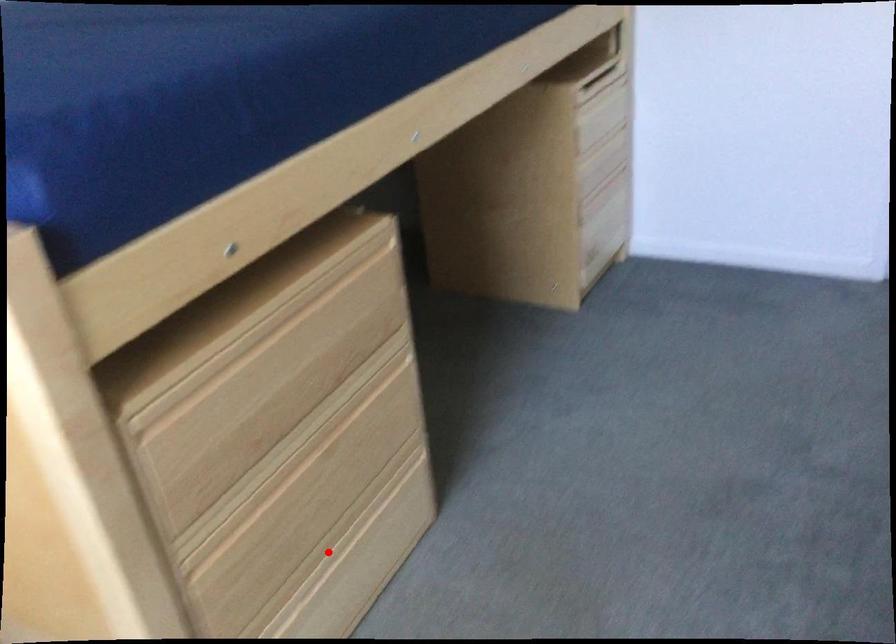
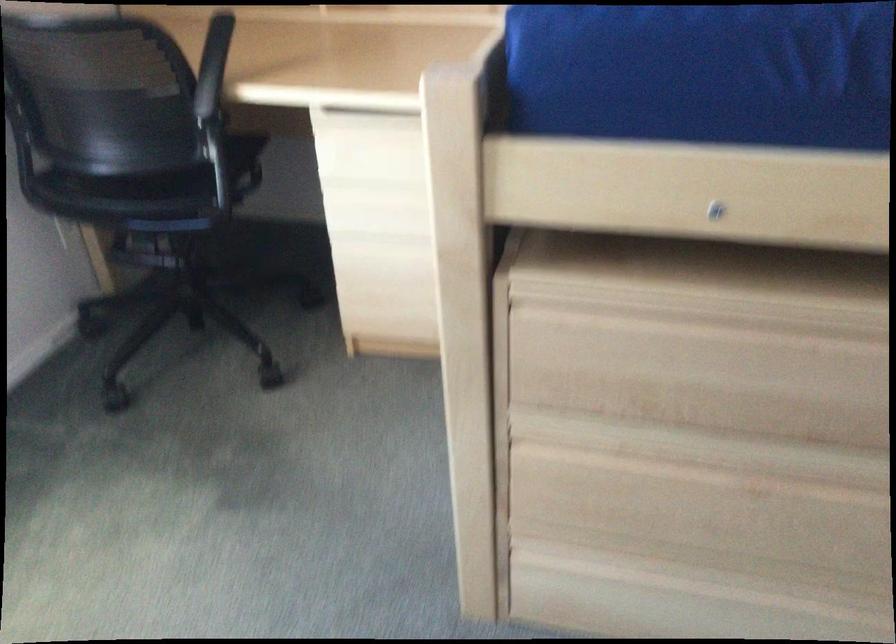
Where in the second image is the point corresponding to the highlighted location from the first image?

(705, 582)